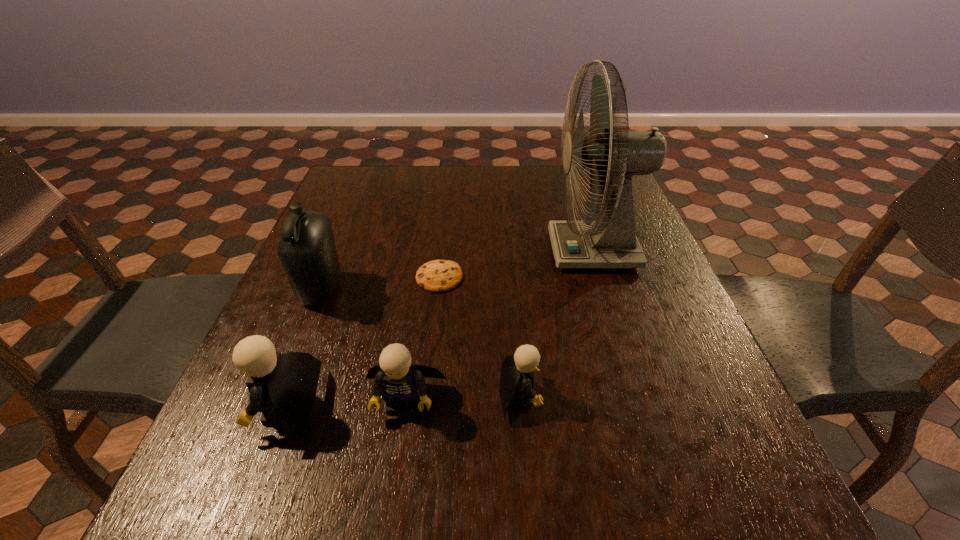
This screenshot has height=540, width=960. I want to click on blank space located on the front-facing side of the fan, so click(x=461, y=251).

Where is `vacant space located on the front-facing side of the fan`? The height and width of the screenshot is (540, 960). vacant space located on the front-facing side of the fan is located at coordinates (429, 251).

Where is `free location located 0.380m on the front-facing side of the fan`? free location located 0.380m on the front-facing side of the fan is located at coordinates (401, 251).

Where is `vacant space located on the back of the cookie`? vacant space located on the back of the cookie is located at coordinates (444, 241).

Image resolution: width=960 pixels, height=540 pixels. Find the location of `vacant space located on the front of the bottle`. vacant space located on the front of the bottle is located at coordinates (276, 404).

Image resolution: width=960 pixels, height=540 pixels. I want to click on Lego positioned at the left edge, so click(283, 387).

Identify the location of bottle that is at the left edge. (307, 250).

This screenshot has width=960, height=540. Find the location of `object at the right edge`. object at the right edge is located at coordinates click(x=610, y=242).

At what (x,y) coordinates should I click in order to perform the action: click on object at the near left corner. Please return your answer as a coordinate pair (x, y). This screenshot has height=540, width=960. Looking at the image, I should click on (283, 387).

The width and height of the screenshot is (960, 540). I want to click on vacant space at the far edge, so click(x=442, y=191).